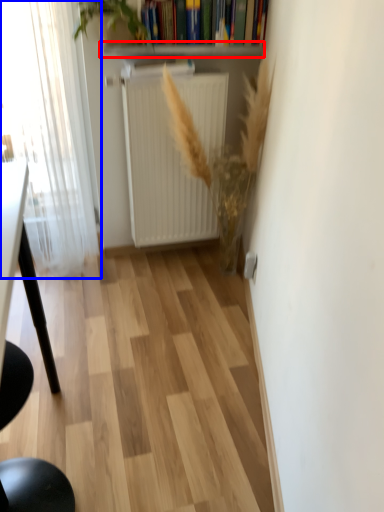
Question: Which point is further to the camera, window sill (highlighted by a red box) or window (highlighted by a blue box)?

Choices:
 (A) window sill
 (B) window

Answer: (A)